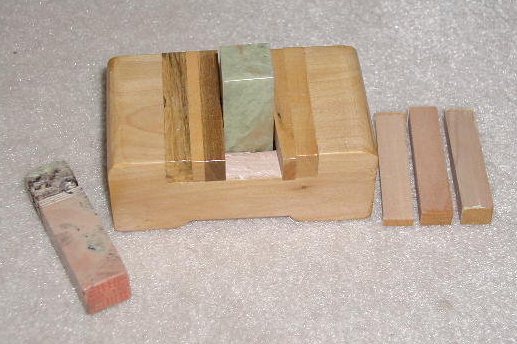
Locate an element on the screen. wooden box is located at coordinates (311, 168).